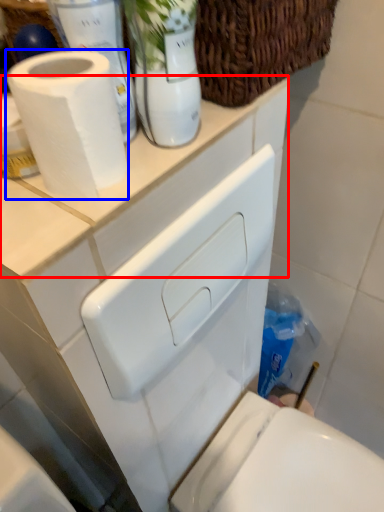
Question: Which of the following is the farthest to the observer, counter top (highlighted by a red box) or toilet paper (highlighted by a blue box)?

Choices:
 (A) counter top
 (B) toilet paper

Answer: (A)